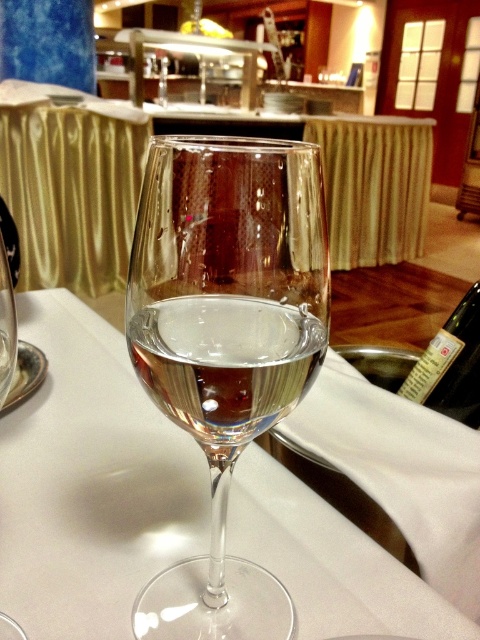
You are a bartender preparing a drink and need to choose between the transparent glass at center and the clear glass wine glass at center. Which glass is taller?

The clear glass wine glass at center is taller than the transparent glass at center.

You are a server in a restaurant and need to place a new green glass bottle at lower right on the table. The current setup has the clear glass wine glass at center. Where should you position the bottle relative to the glass to maintain the existing arrangement?

The clear glass wine glass at center is positioned on the left side of green glass bottle at lower right, so to maintain the existing arrangement, you should place the green glass bottle at lower right to the right of the clear glass wine glass at center.

You are a waiter standing at the edge of the table. You need to place a new wine glass exactly where the clear glass wine glass at center was originally placed. The coordinates provided are point (226, 342). Can you confirm if placing the new glass at these coordinates will be safe, considering the existing table setup described in the scene?

The point (226, 342) is where the clear glass wine glass at center was originally placed. Since the table has a white tablecloth and the glass was safely positioned there before, placing the new glass at these coordinates should be safe.